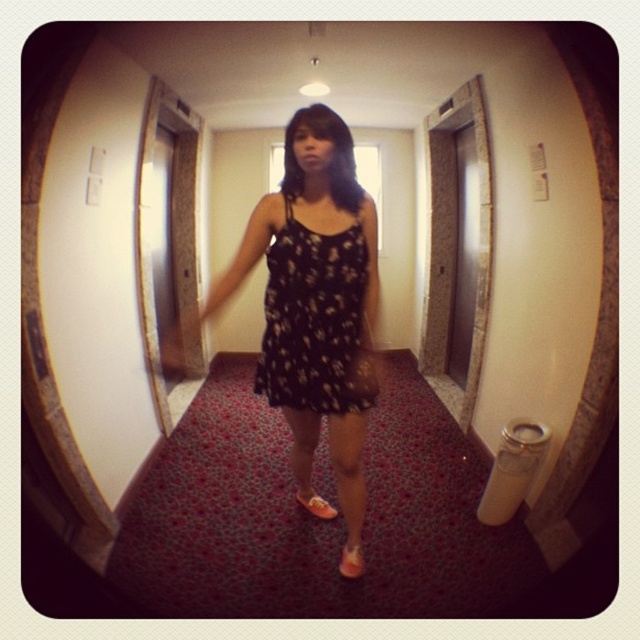
Question: Is black floral dress at center to the right of floral-patterned fabric dress at center from the viewer's perspective?

Choices:
 (A) yes
 (B) no

Answer: (B)

Question: Which of these objects is positioned closest to the orange suede sandal at center?

Choices:
 (A) floral-patterned fabric dress at center
 (B) orange fabric sandal at lower center
 (C) black floral dress at center

Answer: (B)

Question: Which object is the farthest from the orange suede sandal at center?

Choices:
 (A) floral-patterned fabric dress at center
 (B) orange fabric sandal at lower center
 (C) black floral dress at center

Answer: (A)

Question: Does floral-patterned fabric dress at center come behind orange suede sandal at center?

Choices:
 (A) no
 (B) yes

Answer: (A)

Question: Which of the following is the closest to the observer?

Choices:
 (A) orange suede sandal at center
 (B) orange fabric sandal at lower center
 (C) floral-patterned fabric dress at center
 (D) black floral dress at center

Answer: (D)

Question: Does black floral dress at center have a larger size compared to orange suede sandal at center?

Choices:
 (A) yes
 (B) no

Answer: (A)